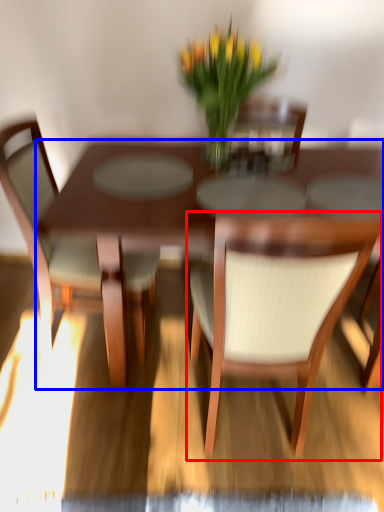
Question: Which of the following is the farthest to the observer, chair (highlighted by a red box) or kitchen & dining room table (highlighted by a blue box)?

Choices:
 (A) chair
 (B) kitchen & dining room table

Answer: (B)